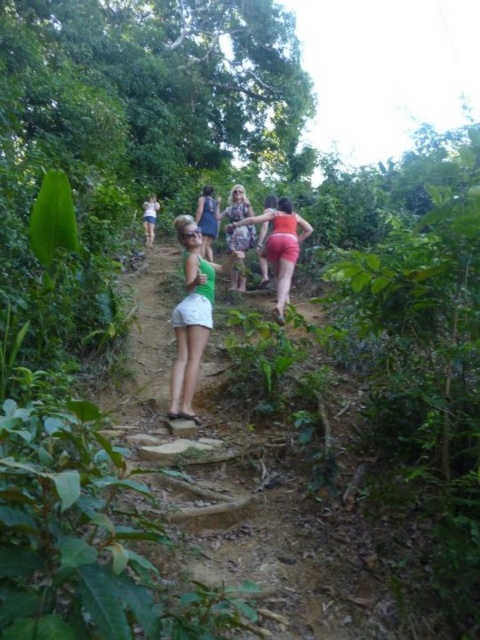
Question: From the image, what is the correct spatial relationship of green matte shorts at center in relation to patterned fabric dress at center?

Choices:
 (A) below
 (B) above

Answer: (A)

Question: Which point is closer to the camera?

Choices:
 (A) (228, 240)
 (B) (154, 202)

Answer: (A)

Question: Estimate the real-world distances between objects in this image. Which object is farther from the white matte shorts at center?

Choices:
 (A) matte coral shorts at center
 (B) green matte shorts at center

Answer: (B)

Question: Can you confirm if green matte shorts at center is positioned to the right of white matte shorts at center?

Choices:
 (A) yes
 (B) no

Answer: (A)

Question: Which object is the farthest from the white matte shorts at center?

Choices:
 (A) matte coral shorts at center
 (B) green matte shorts at center

Answer: (B)

Question: In this image, where is patterned fabric dress at center located relative to white matte shorts at center?

Choices:
 (A) below
 (B) above

Answer: (A)